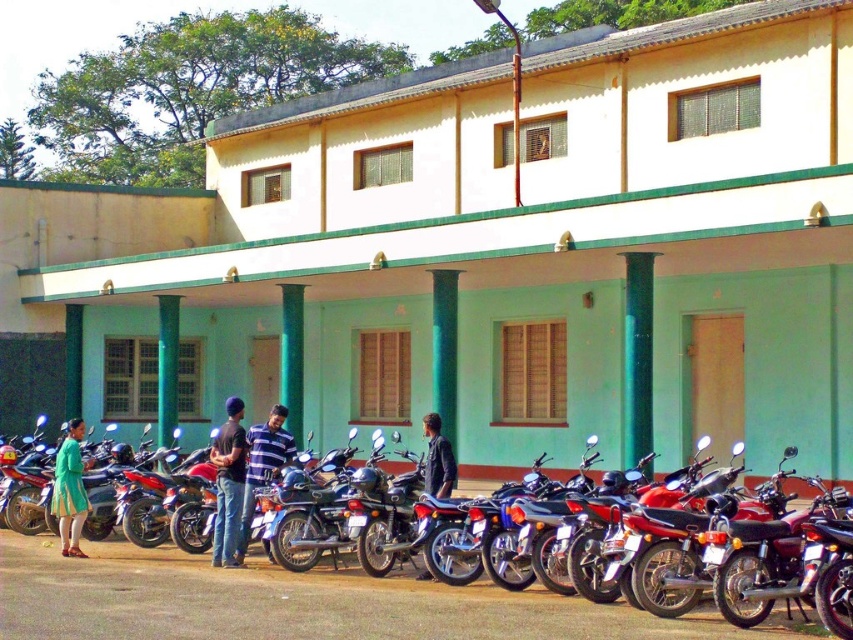
You are standing in front of the two story building and looking at the row of motorcycles. There are two points marked on the motorcycles, one at coordinate point (247, 497) and another at point (434, 461). Which point is closer to you?

Point (247, 497) is further to the camera than point (434, 461), so the point closer to you is point (434, 461).

You are a fashion designer observing a display window of a boutique store. You notice the matte green dress at lower left and the dark blue leather jacket at center. Which item is taller in the display?

Result: The matte green dress at lower left is taller than the dark blue leather jacket at center according to the description.

Consider the image. You are standing in front of the building and notice two shirts hanging at the center. Which shirt is closer to you, the striped fabric shirt at center or the dark blue fabric shirt at center?

The striped fabric shirt at center is closer to you because it is further to the viewer than the dark blue fabric shirt at center.